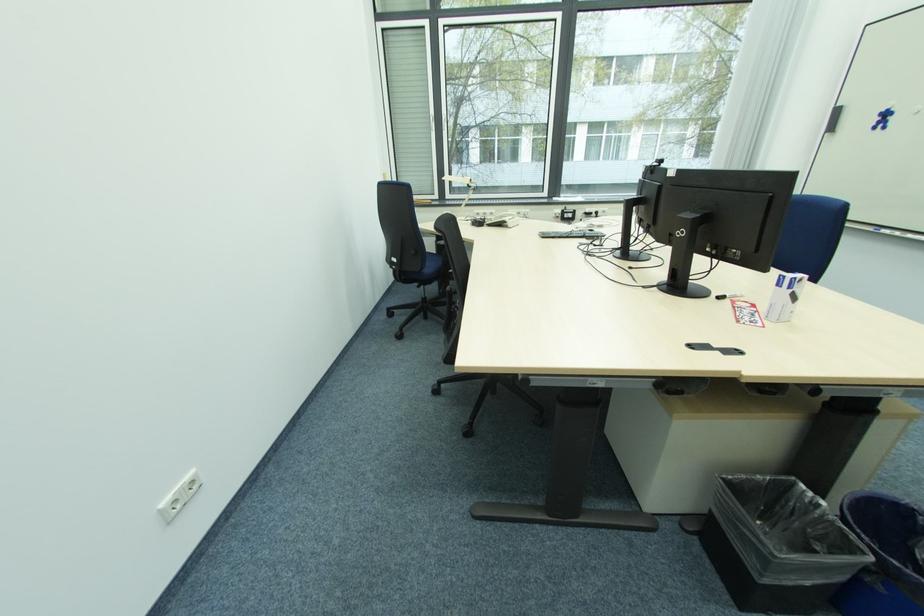
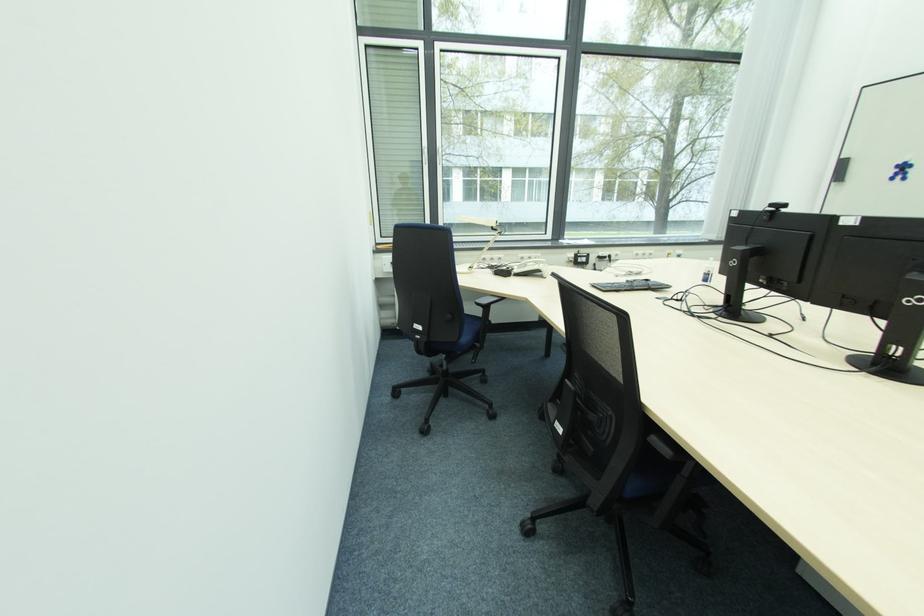
Question: The camera is either moving clockwise (left) or counter-clockwise (right) around the object. The first image is from the beginning of the video and the second image is from the end. Is the camera moving left or right when shooting the video?

Choices:
 (A) Left
 (B) Right

Answer: (A)